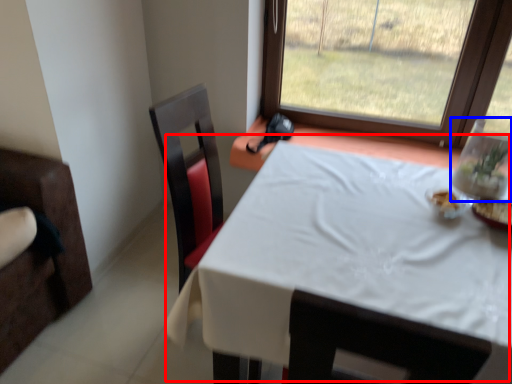
Question: Which of the following is the farthest to the observer, table (highlighted by a red box) or glass vase (highlighted by a blue box)?

Choices:
 (A) table
 (B) glass vase

Answer: (B)